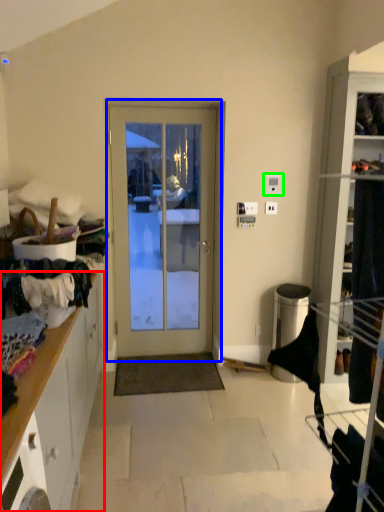
Question: Considering the real-world distances, which object is farthest from cabinetry (highlighted by a red box)? door (highlighted by a blue box) or light switch (highlighted by a green box)?

Choices:
 (A) door
 (B) light switch

Answer: (B)